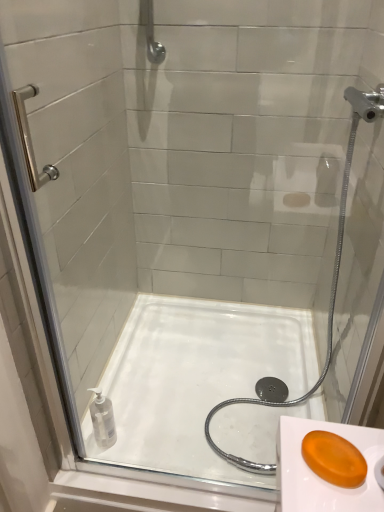
Question: From a real-world perspective, does transparent plastic bottle at lower left stand above white glossy bath at center?

Choices:
 (A) yes
 (B) no

Answer: (A)

Question: From a real-world perspective, is transparent plastic bottle at lower left below white glossy bath at center?

Choices:
 (A) yes
 (B) no

Answer: (B)

Question: Is the position of transparent plastic bottle at lower left less distant than that of white glossy bath at center?

Choices:
 (A) no
 (B) yes

Answer: (A)

Question: Is transparent plastic bottle at lower left at the right side of white glossy bath at center?

Choices:
 (A) no
 (B) yes

Answer: (A)

Question: Are transparent plastic bottle at lower left and white glossy bath at center making contact?

Choices:
 (A) yes
 (B) no

Answer: (B)

Question: From a real-world perspective, is white glossy bath at center above or below transparent plastic bottle at lower left?

Choices:
 (A) below
 (B) above

Answer: (A)

Question: Looking at their shapes, would you say white glossy bath at center is wider or thinner than transparent plastic bottle at lower left?

Choices:
 (A) wide
 (B) thin

Answer: (A)

Question: Visually, is white glossy bath at center positioned to the left or to the right of transparent plastic bottle at lower left?

Choices:
 (A) right
 (B) left

Answer: (A)

Question: From the image's perspective, is white glossy bath at center positioned above or below transparent plastic bottle at lower left?

Choices:
 (A) below
 (B) above

Answer: (B)

Question: Does point (259, 346) appear closer or farther from the camera than point (150, 32)?

Choices:
 (A) farther
 (B) closer

Answer: (A)

Question: Is white glossy bath at center wider or thinner than brushed metal shower handle at upper center?

Choices:
 (A) wide
 (B) thin

Answer: (A)

Question: Visually, is white glossy bath at center positioned to the left or to the right of brushed metal shower handle at upper center?

Choices:
 (A) right
 (B) left

Answer: (A)

Question: In terms of height, does white glossy bath at center look taller or shorter compared to brushed metal shower handle at upper center?

Choices:
 (A) tall
 (B) short

Answer: (B)

Question: In terms of height, does transparent plastic bottle at lower left look taller or shorter compared to white glossy bath at center?

Choices:
 (A) short
 (B) tall

Answer: (B)

Question: In the image, is transparent plastic bottle at lower left positioned in front of or behind white glossy bath at center?

Choices:
 (A) behind
 (B) front

Answer: (A)